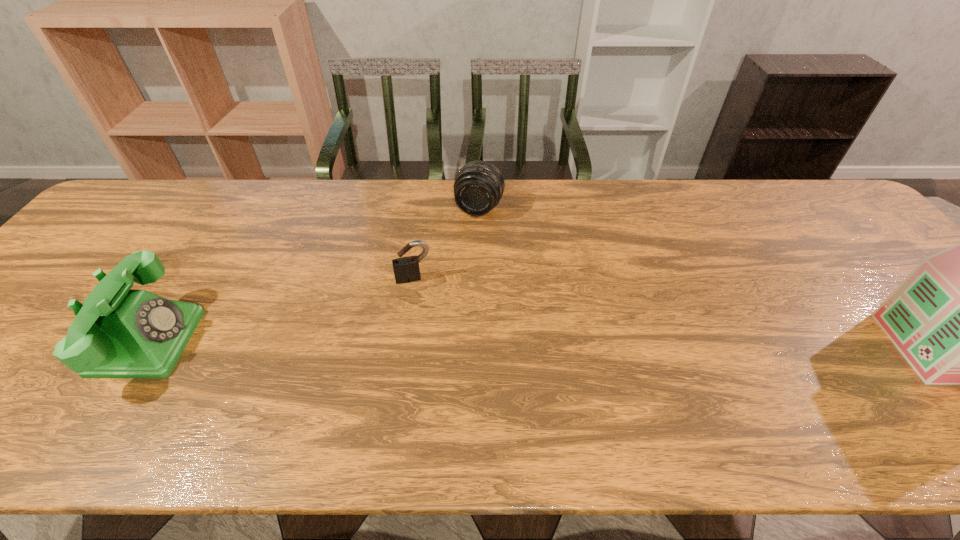
This screenshot has width=960, height=540. In order to click on free spot on the desktop that is between the leftmost object and the tallest object and is positioned with the keyhole on the front of the shortest object in this screenshot , I will do `click(425, 343)`.

The image size is (960, 540). Find the location of `vacant space on the desktop that is between the third shortest object and the tallest object and is positioned at the front element of the third tallest object`. vacant space on the desktop that is between the third shortest object and the tallest object and is positioned at the front element of the third tallest object is located at coordinates (428, 343).